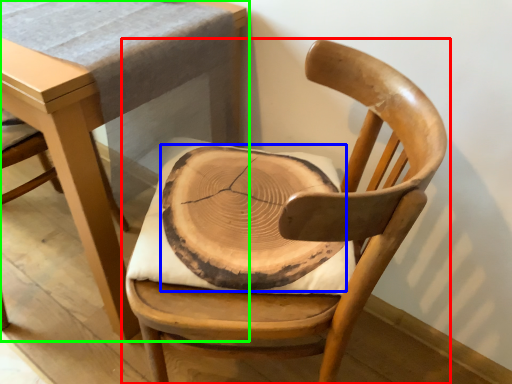
Question: Which is farther away from chair (highlighted by a red box)? pad (highlighted by a blue box) or table (highlighted by a green box)?

Choices:
 (A) pad
 (B) table

Answer: (B)